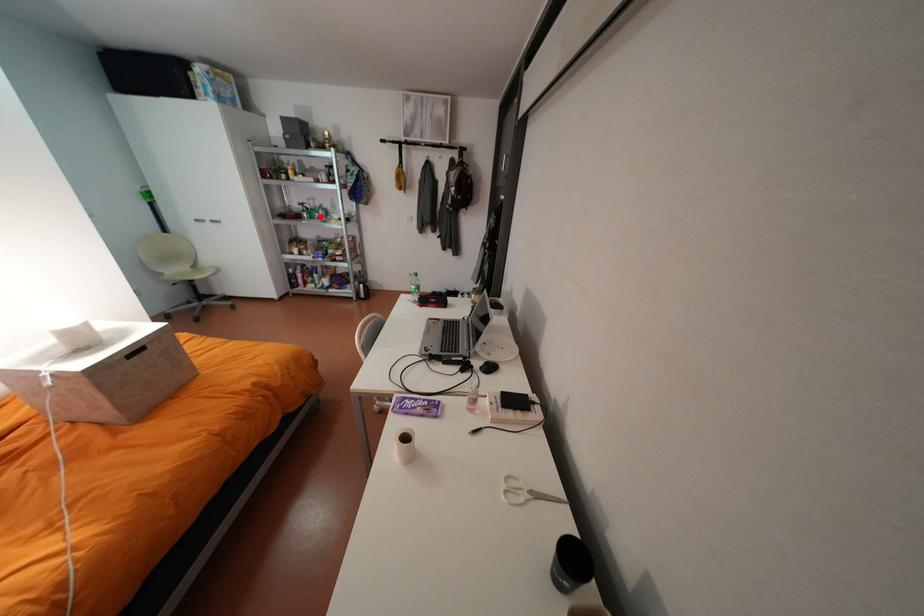
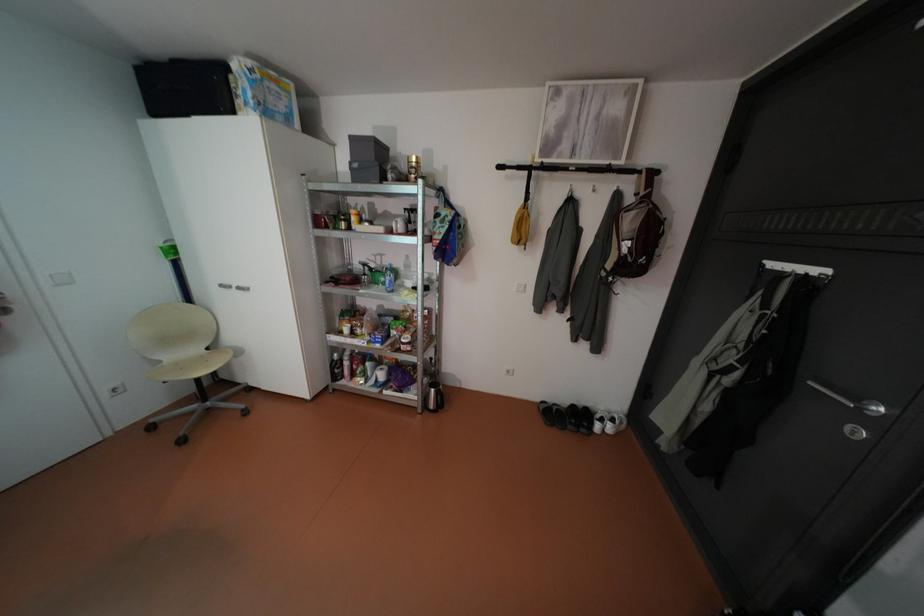
Where in the second image is the point corresponding to the highlighted location from the first image?

(383, 282)